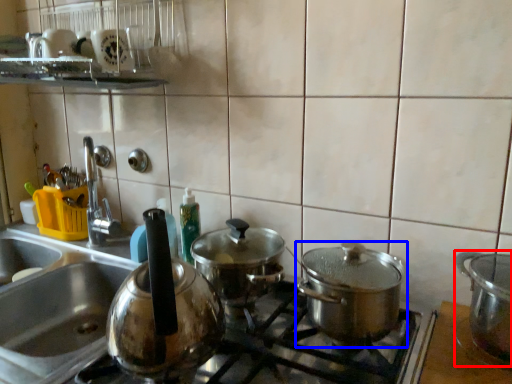
Question: Among these objects, which one is nearest to the camera, kitchen appliance (highlighted by a red box) or kitchen appliance (highlighted by a blue box)?

Choices:
 (A) kitchen appliance
 (B) kitchen appliance

Answer: (B)